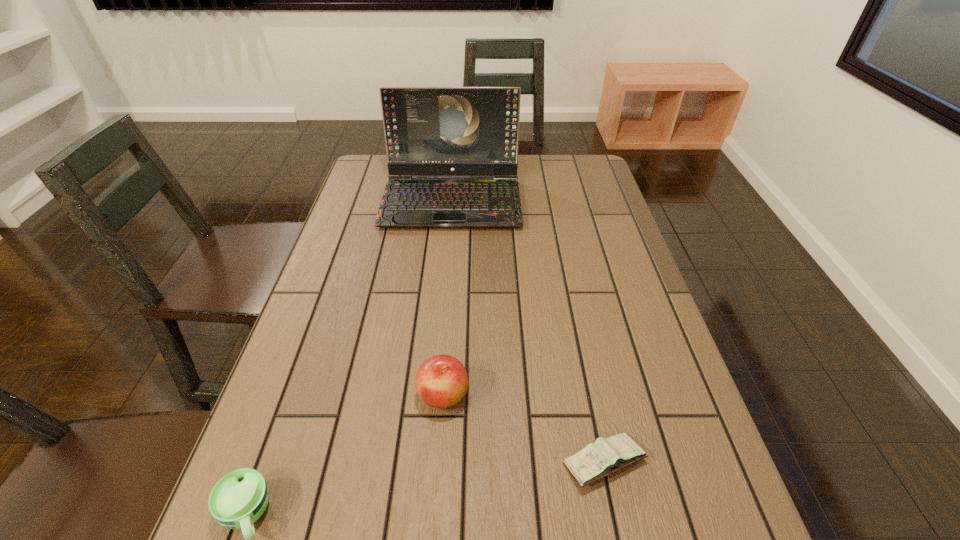
Locate an element on the screen. The image size is (960, 540). laptop computer is located at coordinates (429, 131).

This screenshot has width=960, height=540. Identify the location of the farthest object. (429, 131).

This screenshot has width=960, height=540. I want to click on apple, so click(x=441, y=381).

Locate an element on the screen. This screenshot has height=540, width=960. the second farthest object is located at coordinates (441, 381).

Identify the location of the rightmost object. (597, 460).

This screenshot has width=960, height=540. In order to click on diary in this screenshot , I will do `click(597, 460)`.

Where is `vacant space located 0.320m on the screen of the laptop computer`? Image resolution: width=960 pixels, height=540 pixels. vacant space located 0.320m on the screen of the laptop computer is located at coordinates (443, 312).

Locate an element on the screen. This screenshot has width=960, height=540. free space located 0.240m on the right of the second farthest object is located at coordinates (587, 395).

You are a GUI agent. You are given a task and a screenshot of the screen. Output one action in this format:
    pyautogui.click(x=<x>, y=<y>)
    Task: Click on the vacant region located 0.150m on the left of the rightmost object
    
    Given the screenshot: What is the action you would take?
    (479, 462)

Find the location of a particular element. This screenshot has width=960, height=540. object that is positioned at the far edge is located at coordinates [x=429, y=131].